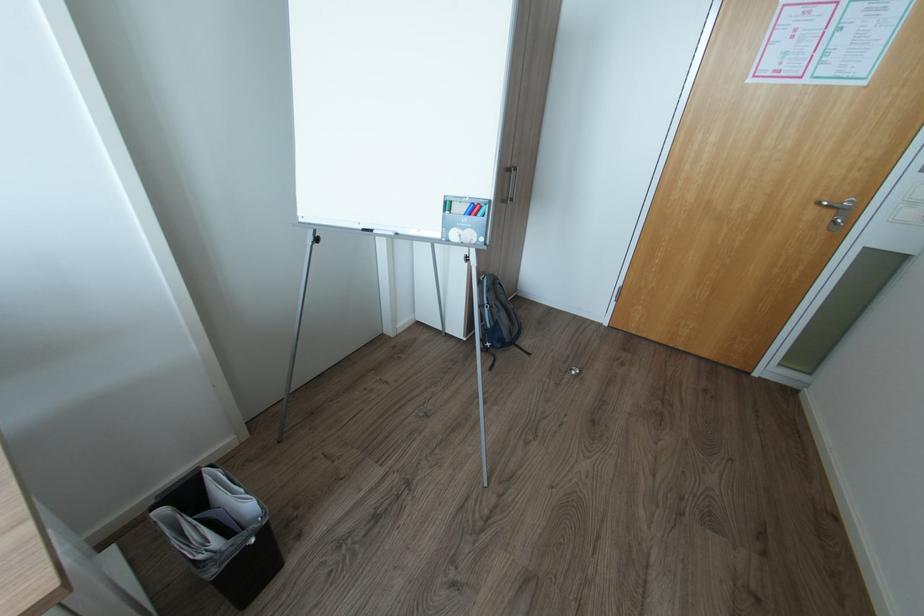
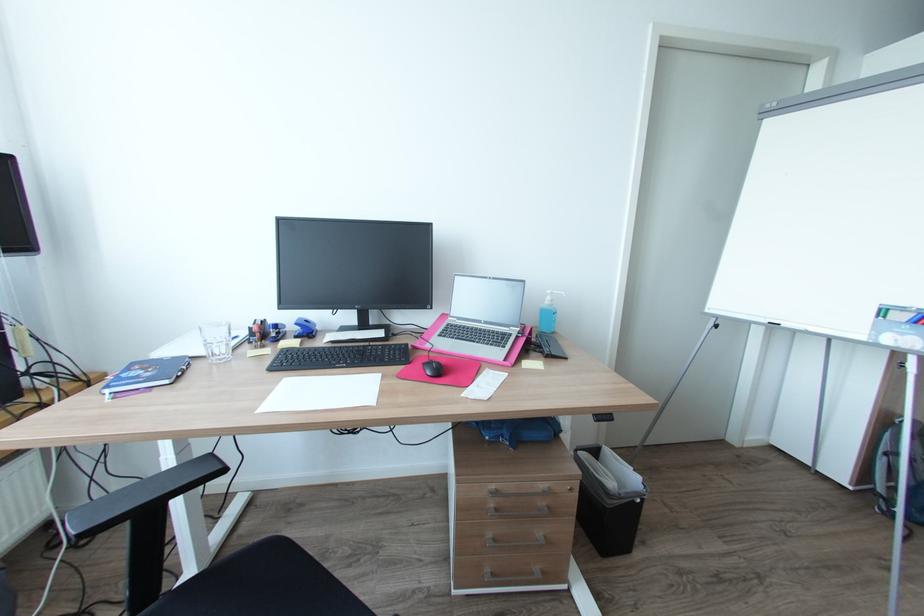
Question: The camera is either moving clockwise (left) or counter-clockwise (right) around the object. The first image is from the beginning of the video and the second image is from the end. Is the camera moving left or right when shooting the video?

Choices:
 (A) Left
 (B) Right

Answer: (B)